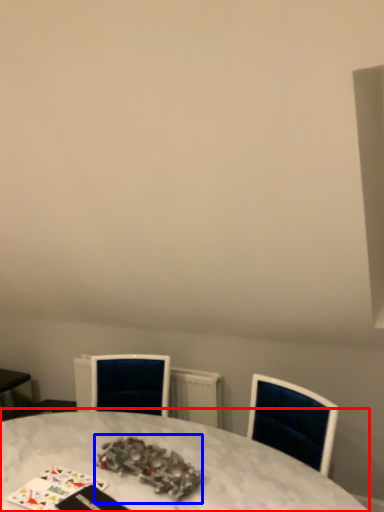
Question: Among these objects, which one is nearest to the camera, table (highlighted by a red box) or christmas decoration (highlighted by a blue box)?

Choices:
 (A) table
 (B) christmas decoration

Answer: (A)